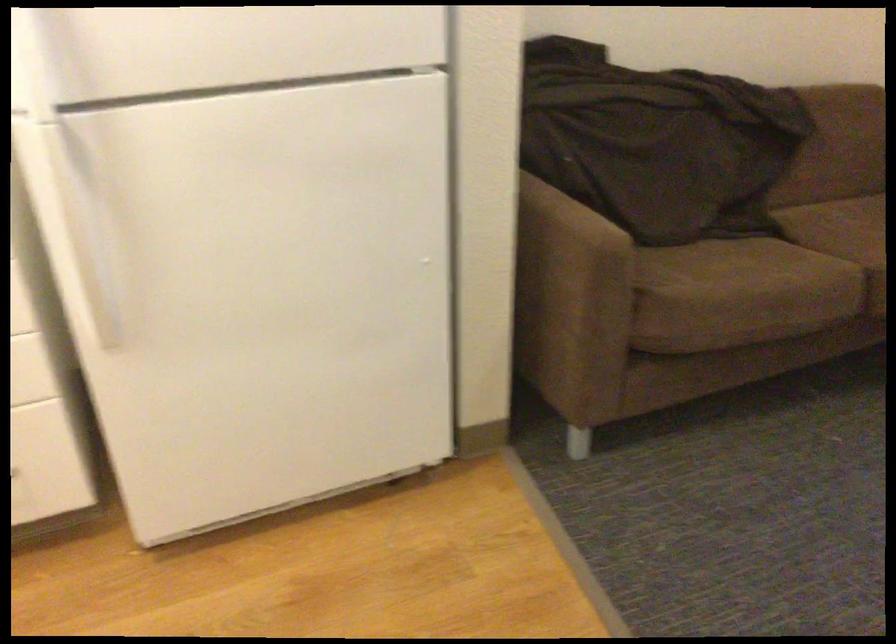
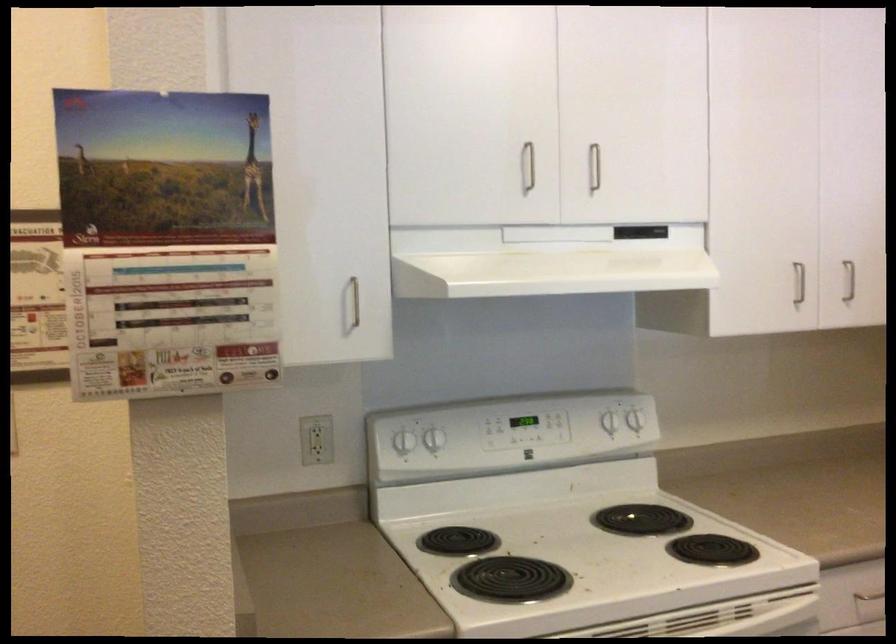
Question: The images are taken continuously from a first-person perspective. In which direction is your viewpoint rotating?

Choices:
 (A) Left
 (B) Right
 (C) Up
 (D) Down

Answer: (A)